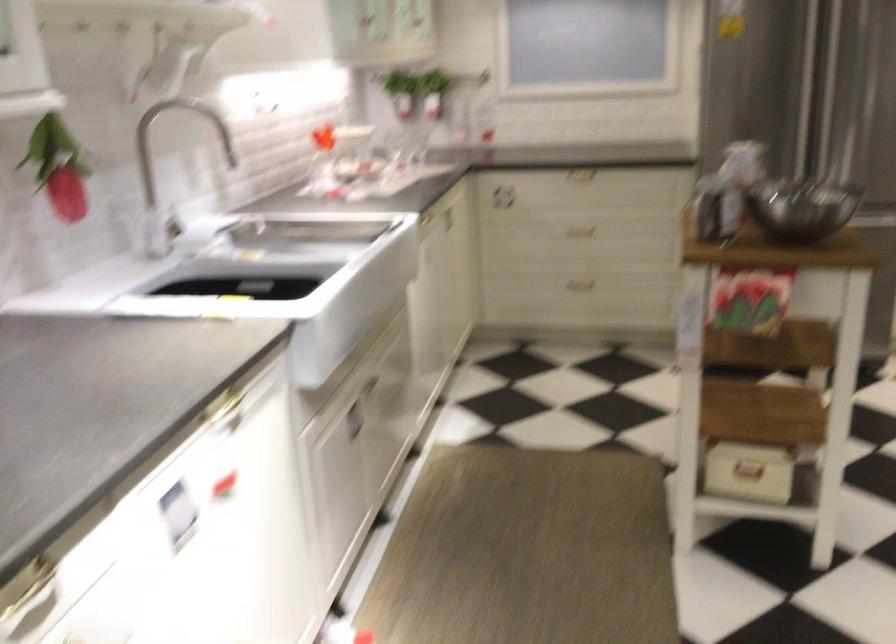
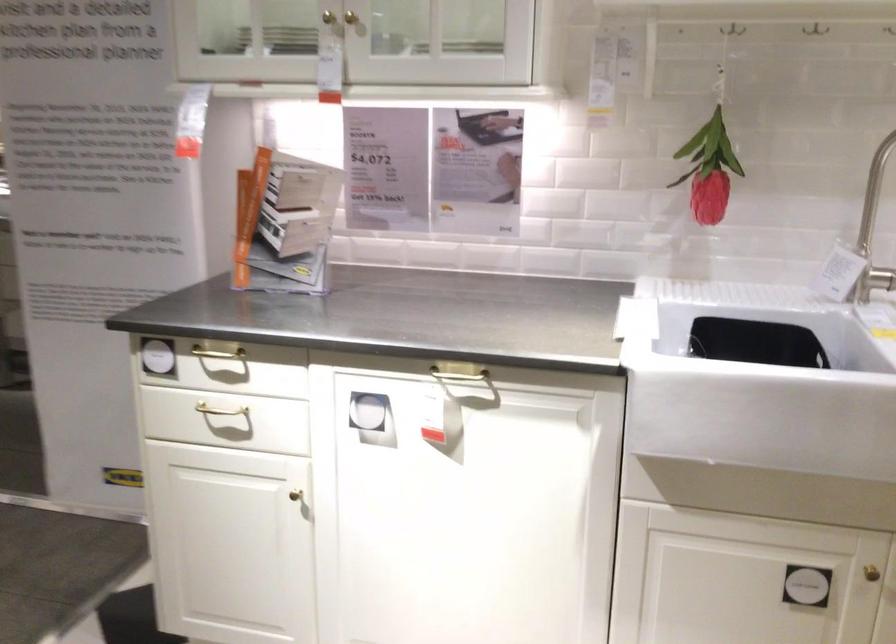
The point at (365, 389) is marked in the first image. Where is the corresponding point in the second image?

(871, 573)